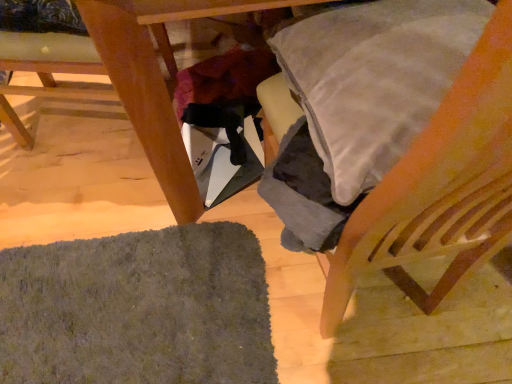
Question: Does wooden table at lower left have a larger size compared to wooden chair at right, placed as the first chair when sorted from right to left?

Choices:
 (A) yes
 (B) no

Answer: (A)

Question: Is wooden table at lower left at the left side of wooden chair at right, the 2th chair viewed from the left?

Choices:
 (A) no
 (B) yes

Answer: (B)

Question: Is wooden table at lower left wider than wooden chair at right, the 2th chair viewed from the left?

Choices:
 (A) no
 (B) yes

Answer: (B)

Question: Does wooden table at lower left have a lesser width compared to wooden chair at right, the 2th chair viewed from the left?

Choices:
 (A) no
 (B) yes

Answer: (A)

Question: Does wooden table at lower left have a lesser height compared to wooden chair at right, placed as the first chair when sorted from right to left?

Choices:
 (A) no
 (B) yes

Answer: (B)

Question: Is wooden table at lower left inside the boundaries of dark gray shaggy mat at lower left, or outside?

Choices:
 (A) inside
 (B) outside

Answer: (B)

Question: In terms of size, does wooden table at lower left appear bigger or smaller than dark gray shaggy mat at lower left?

Choices:
 (A) big
 (B) small

Answer: (A)

Question: From the image's perspective, is wooden table at lower left above or below dark gray shaggy mat at lower left?

Choices:
 (A) below
 (B) above

Answer: (B)

Question: Relative to dark gray shaggy mat at lower left, is wooden table at lower left in front or behind?

Choices:
 (A) behind
 (B) front

Answer: (B)

Question: Visually, is wooden chair at right, the 2th chair viewed from the left, positioned to the left or to the right of wooden table at lower left?

Choices:
 (A) right
 (B) left

Answer: (A)

Question: In terms of height, does wooden chair at right, the 2th chair viewed from the left, look taller or shorter compared to wooden table at lower left?

Choices:
 (A) short
 (B) tall

Answer: (B)

Question: Is point (492, 38) positioned closer to the camera than point (177, 187)?

Choices:
 (A) farther
 (B) closer

Answer: (B)

Question: Is wooden chair at right, the 2th chair viewed from the left, bigger or smaller than wooden table at lower left?

Choices:
 (A) big
 (B) small

Answer: (B)

Question: Is wooden chair at right, placed as the first chair when sorted from right to left, taller or shorter than dark gray shaggy mat at lower left?

Choices:
 (A) short
 (B) tall

Answer: (B)

Question: From a real-world perspective, is wooden chair at right, placed as the first chair when sorted from right to left, positioned above or below dark gray shaggy mat at lower left?

Choices:
 (A) above
 (B) below

Answer: (A)